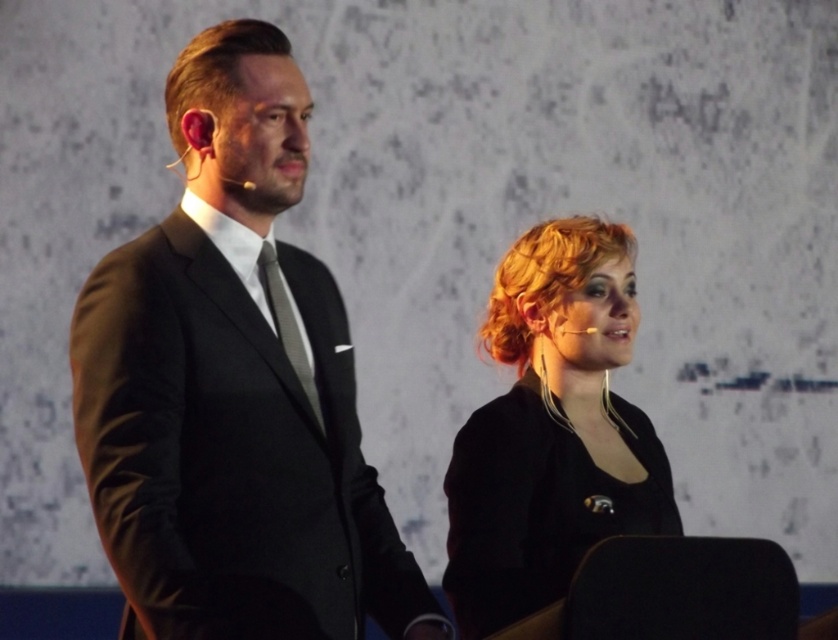
Question: Considering the real-world distances, which object is farthest from the silky gray tie at center?

Choices:
 (A) slicked-back brown hair at upper left
 (B) blonde hair at lower right

Answer: (B)

Question: Does matte black suit at left appear on the right side of blonde hair at lower right?

Choices:
 (A) no
 (B) yes

Answer: (A)

Question: Which object is positioned farthest from the slicked-back brown hair at upper left?

Choices:
 (A) blonde hair at lower right
 (B) silky gray tie at center
 (C) matte black suit at left

Answer: (A)

Question: From the image, what is the correct spatial relationship of blonde hair at lower right in relation to silky gray tie at center?

Choices:
 (A) below
 (B) above

Answer: (A)

Question: Can you confirm if slicked-back brown hair at upper left is positioned below silky gray tie at center?

Choices:
 (A) no
 (B) yes

Answer: (A)

Question: Which point is farther to the camera?

Choices:
 (A) blonde hair at lower right
 (B) slicked-back brown hair at upper left

Answer: (A)